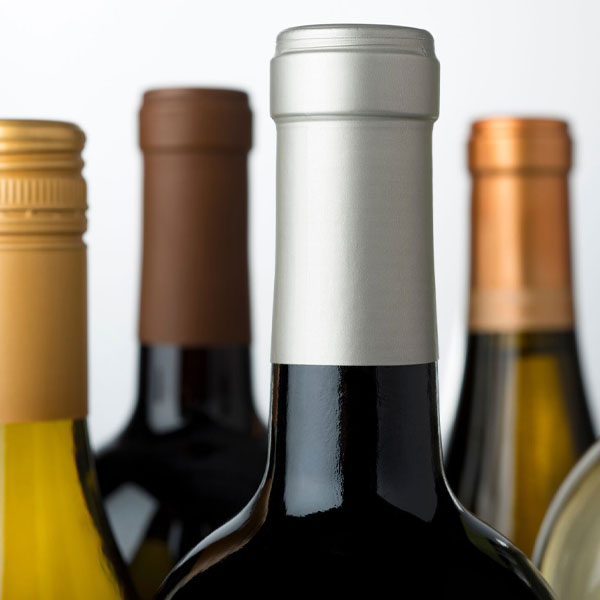
Identify the location of wine bottles (necks). (43, 503), (167, 435), (308, 528), (517, 408), (581, 534).